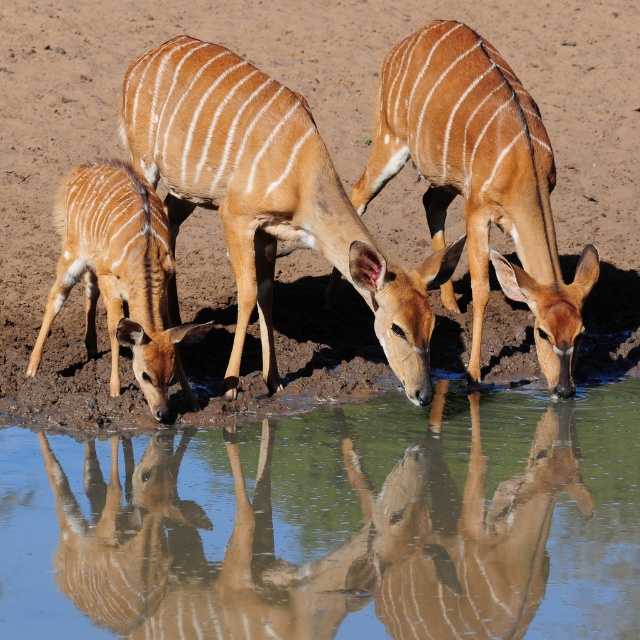
You are observing the waterhole scene and notice the brown glossy antelope at center. Based on its position, can you determine if its reflection would appear to the left or right of its actual position?

The brown glossy antelope at center is located at point (481,179). Since reflections in water mirror the actual position horizontally, the reflection would appear directly below the antelope, not to the left or right. However, if considering coordinates, the reflection would have the same x coordinate but mirrored y coordinate, so it would be vertically below, not horizontally offset.

Based on the photo, you are a photographer aiming to capture the reflection of the brown glossy antelope at center and the light brown fur at lower left in the waterhole. Which animal will have its reflection closer to the center of the waterhole?

The brown glossy antelope at center is positioned on the right side of light brown fur at lower left, so its reflection will be closer to the center of the waterhole.

You are a wildlife photographer aiming to capture a photo of both the brown striped antelope at center and the brown glossy antelope at center. Since you want to highlight their height difference, which antelope should you position closer to the camera to emphasize its smaller size?

To emphasize the smaller size of the brown striped antelope at center, position it closer to the camera. Since it has a lesser height compared to the brown glossy antelope at center, placing it nearer will make it appear larger in the photo, creating a visual contrast between their actual heights.